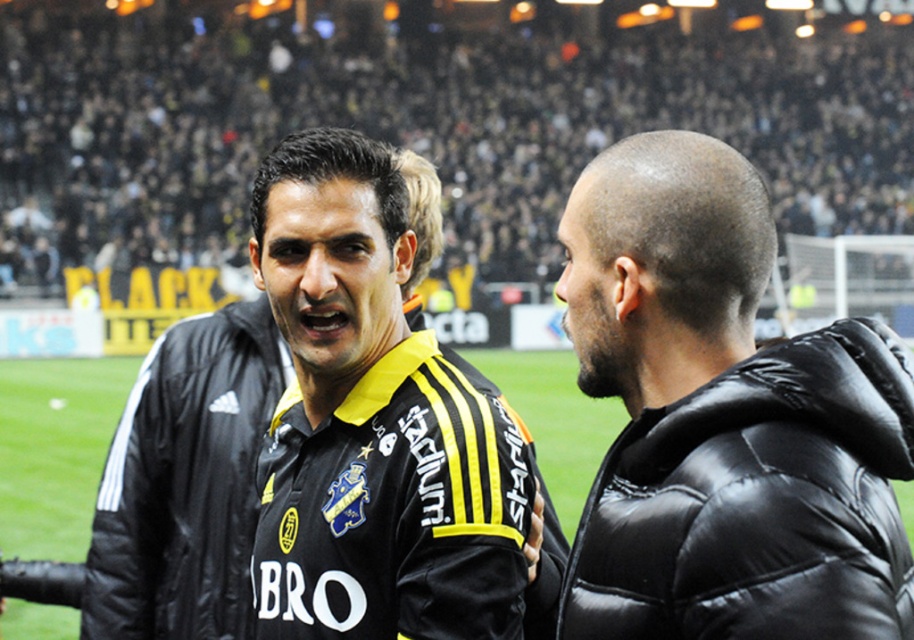
Question: Which point is closer to the camera?

Choices:
 (A) black puffy jacket at right
 (B) black matte jersey at center

Answer: (A)

Question: Which of the following is the closest to the observer?

Choices:
 (A) (832, 365)
 (B) (303, 465)

Answer: (A)

Question: Is black puffy jacket at right below yellow/black striped jersey at center?

Choices:
 (A) no
 (B) yes

Answer: (B)

Question: Observing the image, what is the correct spatial positioning of black puffy jacket at right in reference to yellow/black striped jersey at center?

Choices:
 (A) below
 (B) above

Answer: (A)

Question: Can you confirm if black matte jersey at center is thinner than yellow/black striped jersey at center?

Choices:
 (A) no
 (B) yes

Answer: (B)

Question: Which of these objects is positioned closest to the black puffy jacket at right?

Choices:
 (A) black matte jersey at center
 (B) yellow/black striped jersey at center

Answer: (A)